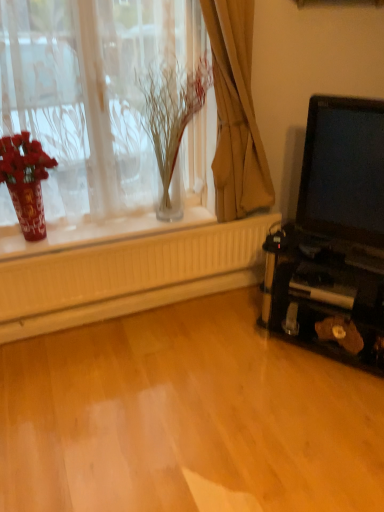
Question: Considering the relative sizes of brown fabric curtain at upper center and translucent glass vase at upper left in the image provided, is brown fabric curtain at upper center shorter than translucent glass vase at upper left?

Choices:
 (A) yes
 (B) no

Answer: (A)

Question: Does brown fabric curtain at upper center have a lesser width compared to translucent glass vase at upper left?

Choices:
 (A) no
 (B) yes

Answer: (B)

Question: From a real-world perspective, is brown fabric curtain at upper center located higher than translucent glass vase at upper left?

Choices:
 (A) yes
 (B) no

Answer: (B)

Question: Is brown fabric curtain at upper center far away from translucent glass vase at upper left?

Choices:
 (A) no
 (B) yes

Answer: (A)

Question: From a real-world perspective, is brown fabric curtain at upper center physically below translucent glass vase at upper left?

Choices:
 (A) no
 (B) yes

Answer: (B)

Question: Is point (21, 156) closer or farther from the camera than point (349, 230)?

Choices:
 (A) farther
 (B) closer

Answer: (A)

Question: Choose the correct answer: Is shiny red vase at left inside matte black laptop at right or outside it?

Choices:
 (A) outside
 (B) inside

Answer: (A)

Question: From the image's perspective, is shiny red vase at left above or below matte black laptop at right?

Choices:
 (A) above
 (B) below

Answer: (B)

Question: From a real-world perspective, is shiny red vase at left above or below matte black laptop at right?

Choices:
 (A) above
 (B) below

Answer: (B)

Question: Is matte black laptop at right to the left or to the right of brown fabric curtain at upper center in the image?

Choices:
 (A) left
 (B) right

Answer: (B)

Question: From their relative heights in the image, would you say matte black laptop at right is taller or shorter than brown fabric curtain at upper center?

Choices:
 (A) short
 (B) tall

Answer: (A)

Question: Is matte black laptop at right bigger or smaller than brown fabric curtain at upper center?

Choices:
 (A) small
 (B) big

Answer: (A)

Question: Considering the positions of point (365, 192) and point (244, 11), is point (365, 192) closer or farther from the camera than point (244, 11)?

Choices:
 (A) closer
 (B) farther

Answer: (A)

Question: From a real-world perspective, is translucent glass vase at upper left above or below translucent glass vase at upper center?

Choices:
 (A) below
 (B) above

Answer: (B)

Question: Considering the positions of translucent glass vase at upper left and translucent glass vase at upper center in the image, is translucent glass vase at upper left taller or shorter than translucent glass vase at upper center?

Choices:
 (A) tall
 (B) short

Answer: (A)